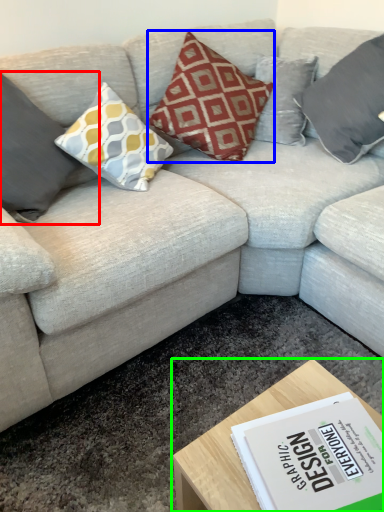
Question: Which object is positioned farthest from pillow (highlighted by a red box)? Select from pillow (highlighted by a blue box) and coffee table (highlighted by a green box).

Choices:
 (A) pillow
 (B) coffee table

Answer: (B)